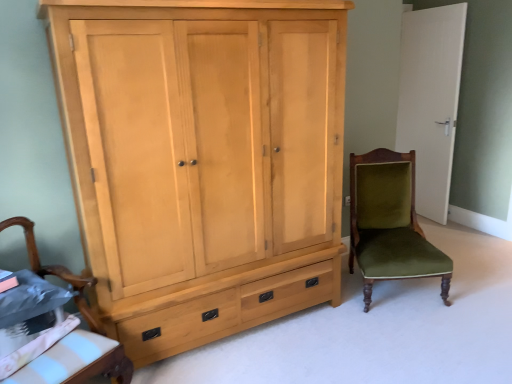
Find the location of a particular element. free spot in front of velvet green chair at right, placed as the second chair when sorted from left to right is located at coordinates (420, 332).